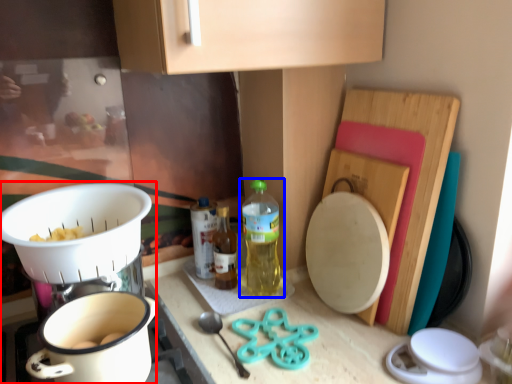
Question: Which object appears closest to the camera in this image, appliance (highlighted by a red box) or bottle (highlighted by a blue box)?

Choices:
 (A) appliance
 (B) bottle

Answer: (A)